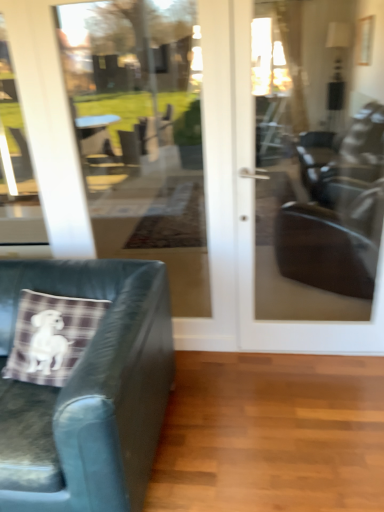
Where is `vacant space that is to the left of matte glass door at center`? vacant space that is to the left of matte glass door at center is located at coordinates (236, 378).